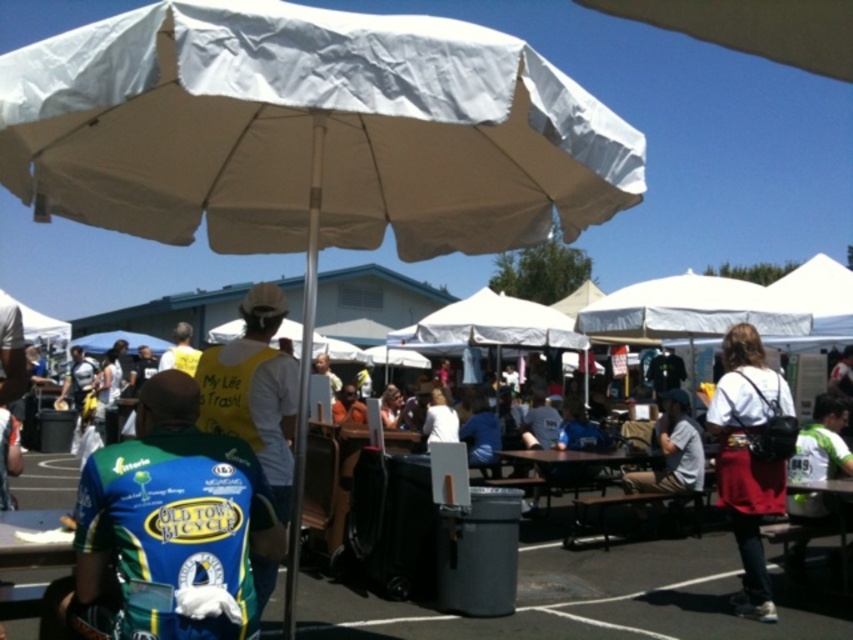
Question: Observing the image, what is the correct spatial positioning of blue jersey at center in reference to white matte shirt at center?

Choices:
 (A) right
 (B) left

Answer: (B)

Question: Which point is closer to the camera?

Choices:
 (A) (602, 481)
 (B) (746, 392)
 (C) (96, 499)

Answer: (C)

Question: Among these points, which one is farthest from the camera?

Choices:
 (A) (633, 492)
 (B) (582, 461)
 (C) (180, 490)
 (D) (776, 512)

Answer: (A)

Question: Is blue jersey at center positioned behind white cotton shirt at center?

Choices:
 (A) no
 (B) yes

Answer: (A)

Question: Is blue jersey at center to the left of wooden picnic table at center from the viewer's perspective?

Choices:
 (A) no
 (B) yes

Answer: (B)

Question: Which point is farther from the camera taking this photo?

Choices:
 (A) (685, 444)
 (B) (547, 492)
 (C) (207, 630)

Answer: (B)